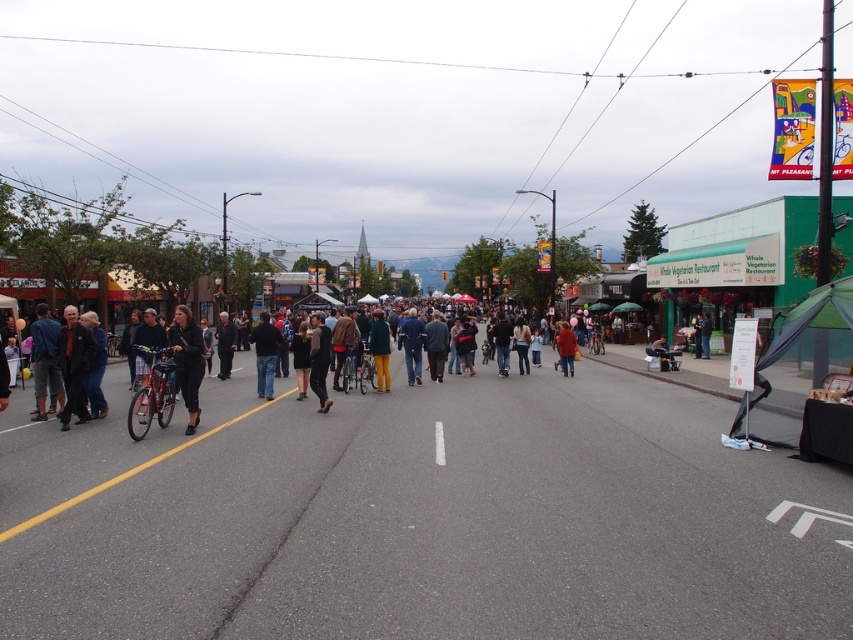
Question: Which point is farther to the camera?

Choices:
 (A) denim jacket at center
 (B) dark gray jacket at center
 (C) dark brown leather jacket at center
 (D) matte black jacket at center

Answer: (A)

Question: Which object is farther from the camera taking this photo?

Choices:
 (A) dark gray jacket at center
 (B) dark gray jacket at left

Answer: (A)

Question: Is dark blue jeans at center further to the viewer compared to denim jacket at center?

Choices:
 (A) no
 (B) yes

Answer: (A)

Question: Does dark gray jacket at left have a smaller size compared to dark brown leather jacket at center?

Choices:
 (A) yes
 (B) no

Answer: (A)

Question: Is matte black jacket at center below dark blue jeans at center?

Choices:
 (A) no
 (B) yes

Answer: (B)

Question: Which object is the closest to the dark brown leather jacket at center?

Choices:
 (A) matte black jacket at center
 (B) green fabric jacket at center

Answer: (B)